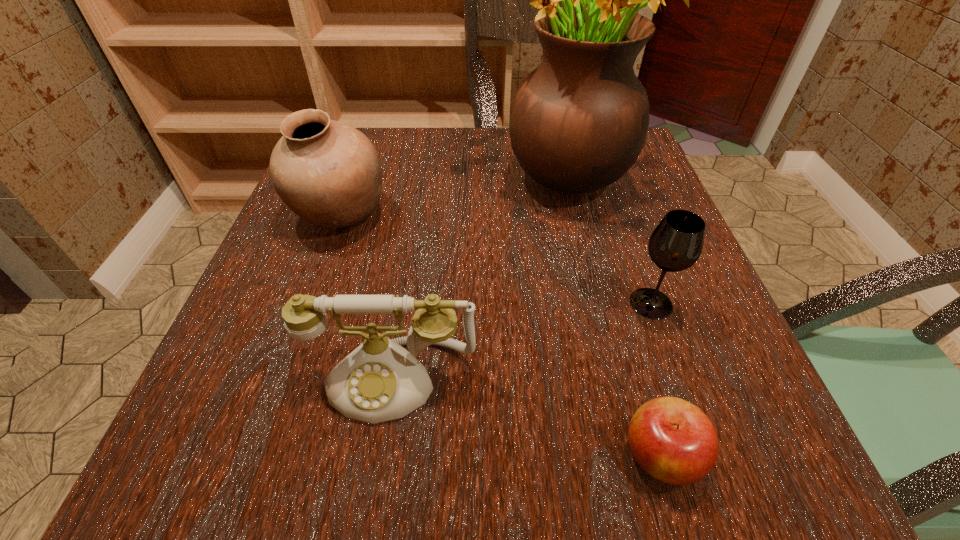
Where is `the tallest object`? Image resolution: width=960 pixels, height=540 pixels. the tallest object is located at coordinates (579, 121).

Find the location of `the fourth shortest object`. the fourth shortest object is located at coordinates (327, 172).

Locate an element on the screen. wineglass is located at coordinates (676, 243).

Where is `telephone`? This screenshot has width=960, height=540. telephone is located at coordinates (379, 381).

Where is `apple`? The image size is (960, 540). apple is located at coordinates (674, 441).

You are a GUI agent. You are given a task and a screenshot of the screen. Output one action in this format:
    pyautogui.click(x=<x>, y=<y>)
    Task: Click on the vacant space located 0.360m on the left of the flower arrangement
    
    Given the screenshot: What is the action you would take?
    pyautogui.click(x=307, y=172)

Find the location of `vacant area situated on the front of the second tallest object`. vacant area situated on the front of the second tallest object is located at coordinates (312, 294).

Locate an element on the screen. This screenshot has height=540, width=960. free space located 0.230m on the back of the wineglass is located at coordinates (615, 203).

Where is `vacant space situated on the dial of the telephone`? vacant space situated on the dial of the telephone is located at coordinates (373, 490).

Locate an element on the screen. vacant region located on the left of the shortest object is located at coordinates (382, 456).